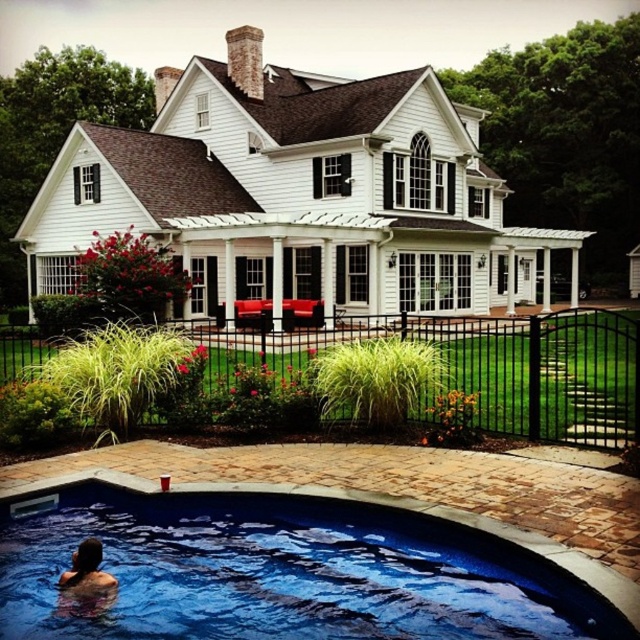
Question: Which point is closer to the camera?

Choices:
 (A) blue smooth water at lower center
 (B) smooth skin person at lower left

Answer: (A)

Question: Is blue smooth water at lower center further to camera compared to smooth skin person at lower left?

Choices:
 (A) yes
 (B) no

Answer: (B)

Question: Can you confirm if blue smooth water at lower center is wider than smooth skin person at lower left?

Choices:
 (A) yes
 (B) no

Answer: (A)

Question: Is the position of blue smooth water at lower center less distant than that of smooth skin person at lower left?

Choices:
 (A) yes
 (B) no

Answer: (A)

Question: Which of the following is the farthest from the observer?

Choices:
 (A) smooth skin person at lower left
 (B) blue smooth water at lower center

Answer: (A)